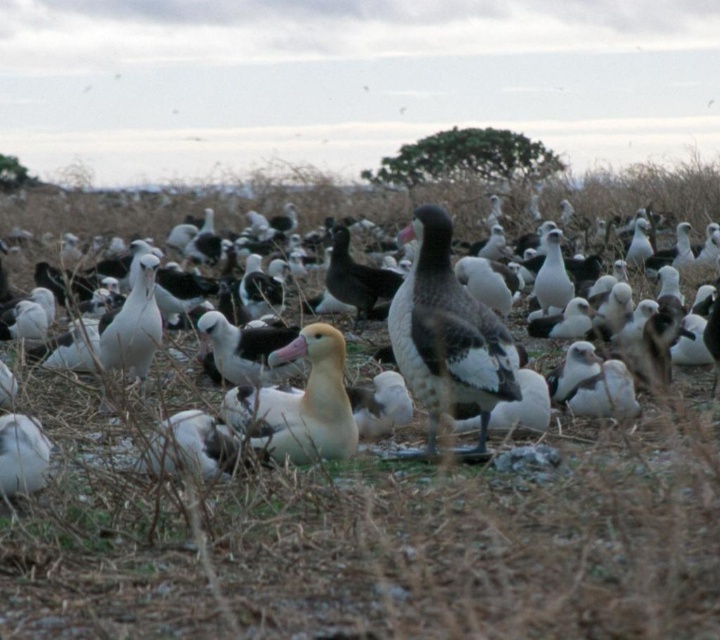
You are a wildlife photographer aiming to capture a closeup shot of both the golden brown feathers at center and the dark brown feathers at center in the same frame. Your camera has a maximum focus range of 5 meters. Can you achieve this without moving your position?

The golden brown feathers at center is 5.32 meters away from dark brown feathers at center, which exceeds the camera maximum focus range of 5 meters. So you can not capture both in the same frame without moving your position.

You are a wildlife photographer aiming to capture a closeup of the golden brown feathers at center. Your camera has a minimum focusing distance of 3 meters. Can you take the photo without moving closer than 3 meters?

The golden brown feathers at center are 4.46 meters away from the camera, which is beyond the minimum focusing distance of 3 meters. Therefore, you can take the closeup without moving closer than 3 meters.